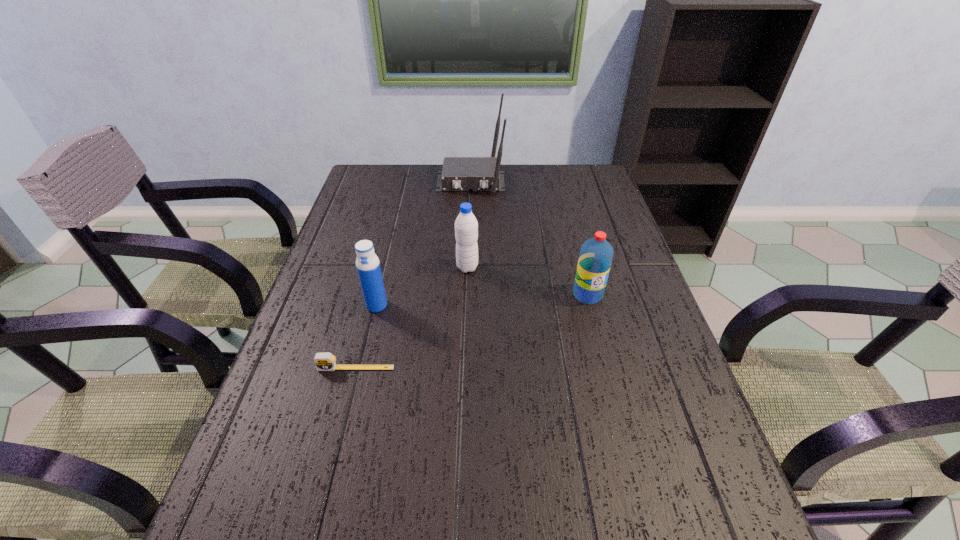
This screenshot has height=540, width=960. I want to click on vacant area at the far left corner, so click(x=378, y=179).

This screenshot has width=960, height=540. I want to click on free space at the far right corner of the desktop, so click(575, 184).

The height and width of the screenshot is (540, 960). What are the coordinates of `free space that is in between the nearest object and the leftmost water bottle` in the screenshot? It's located at (366, 336).

The height and width of the screenshot is (540, 960). Find the location of `vacant region between the fourth nearest object and the nearest object`. vacant region between the fourth nearest object and the nearest object is located at coordinates (412, 318).

The image size is (960, 540). What are the coordinates of `free space that is in between the tape measure and the second water bottle from right to left` in the screenshot? It's located at (412, 318).

Identify the location of vacant area that lies between the tape measure and the tallest object. (x=413, y=275).

Locate an element on the screen. The height and width of the screenshot is (540, 960). free space between the leftmost water bottle and the router is located at coordinates pos(423,244).

I want to click on free space between the farthest water bottle and the rightmost object, so click(527, 281).

At what (x,y) coordinates should I click in order to perform the action: click on unoccupied area between the tape measure and the second water bottle from right to left. Please return your answer as a coordinate pair (x, y). The height and width of the screenshot is (540, 960). Looking at the image, I should click on (412, 318).

Where is `vacant space in between the tallest object and the leftmost water bottle`? The image size is (960, 540). vacant space in between the tallest object and the leftmost water bottle is located at coordinates (423, 244).